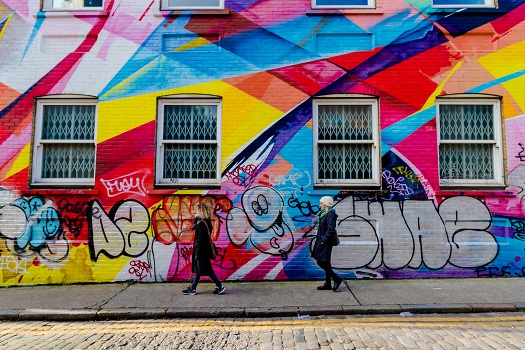
Identify the location of window frame. The image size is (525, 350). (39, 135), (47, 3), (164, 2), (312, 0), (489, 1), (495, 153), (374, 158), (161, 151).